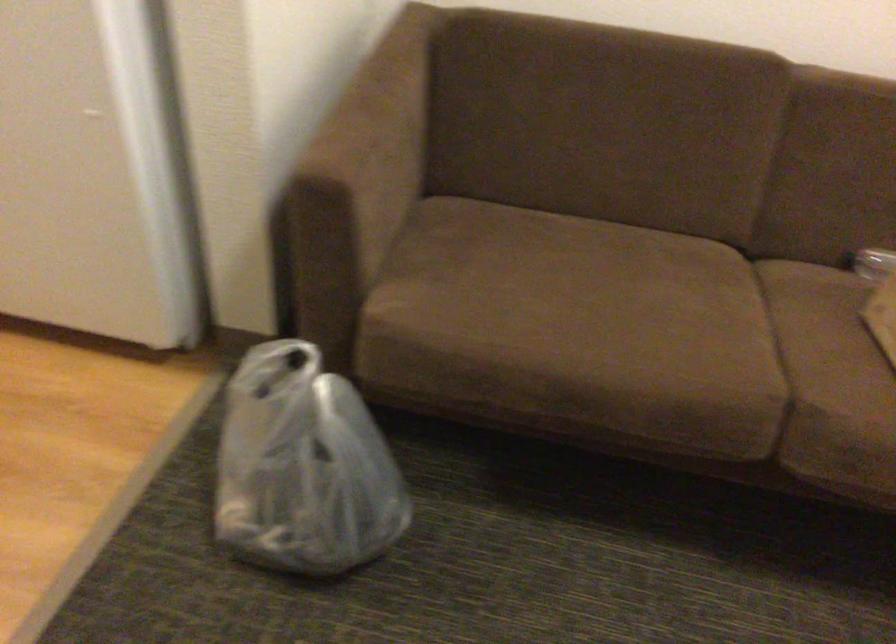
The location [304,467] corresponds to which object?

This point indicates the plastic bag.